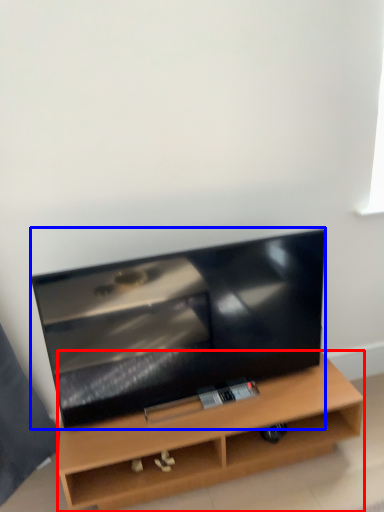
Question: Which point is further to the camera, furniture (highlighted by a red box) or television (highlighted by a blue box)?

Choices:
 (A) furniture
 (B) television

Answer: (A)